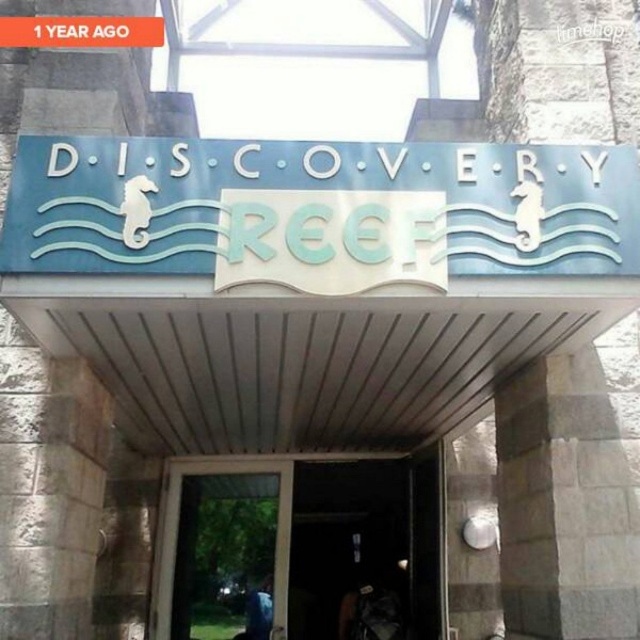
Consider the image. You are standing at the entrance of Discovery Reef and want to take a photo of the sign. The camera you are using has a maximum focus range of 2 meters. Will the sign be in focus if you position yourself at point (65, 196)?

The distance between point (65, 196) and the camera is 2.39 meters, which exceeds the camera maximum focus range of 2 meters. Therefore, the sign will not be in focus.

In the scene shown: Based on the scene description, where is the entrance to Discovery Reef located relative to the transparent glass door at center marked by point [301,548]?

The entrance to Discovery Reef is located at the transparent glass door at center marked by point [301,548].

You are a delivery person approaching the entrance of Discovery Reef. You need to place a package on the sign that is wider. Which sign should you choose between the blue matte sign at upper center and the blue metallic sign at upper center?

The blue matte sign at upper center is wider than the blue metallic sign at upper center, so you should place the package on the blue matte sign at upper center.